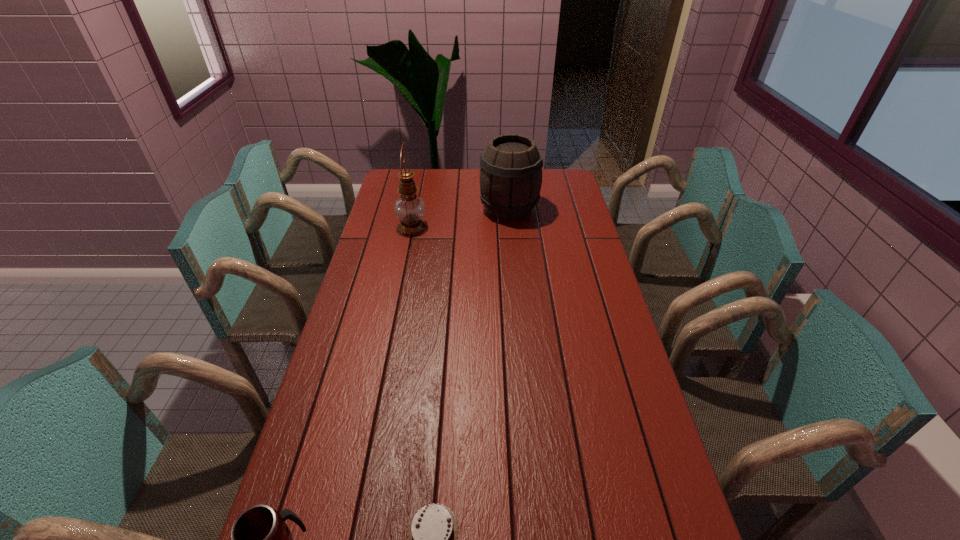
Locate an element on the screen. oil lamp is located at coordinates (409, 208).

Locate an element on the screen. This screenshot has width=960, height=540. the tallest object is located at coordinates (409, 208).

This screenshot has height=540, width=960. I want to click on wine bucket, so click(511, 165).

Where is `the third shortest object`? The height and width of the screenshot is (540, 960). the third shortest object is located at coordinates (511, 165).

I want to click on vacant space located on the back of the tallest object, so click(418, 200).

Where is `free location located on the back of the rightmost object`? free location located on the back of the rightmost object is located at coordinates point(506,176).

This screenshot has height=540, width=960. I want to click on object that is at the far edge, so click(511, 165).

Where is `object at the left edge`? The image size is (960, 540). object at the left edge is located at coordinates (409, 208).

Image resolution: width=960 pixels, height=540 pixels. In the image, there is a desktop. Identify the location of free space at the far edge. coord(475,168).

In the image, there is a desktop. Identify the location of free region at the left edge. pos(350,306).